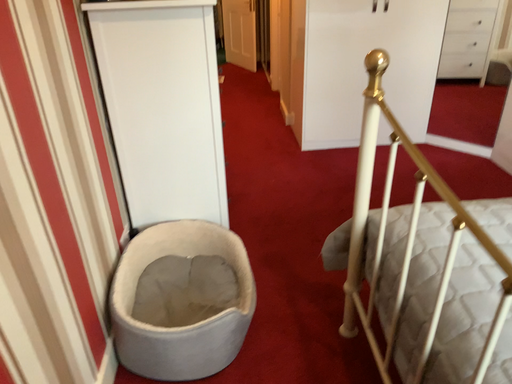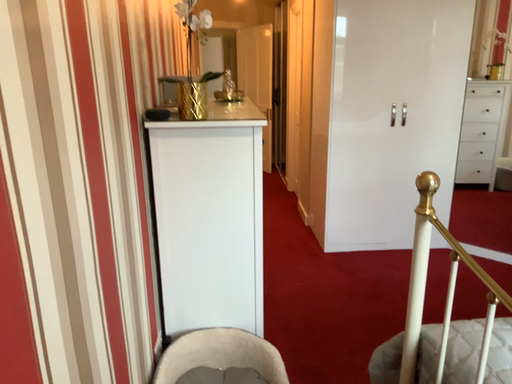
Question: Which way did the camera rotate in the video?

Choices:
 (A) rotated upward
 (B) rotated downward

Answer: (A)